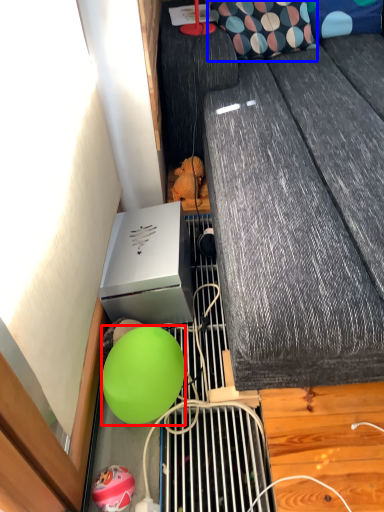
Question: Which object appears closest to the camera in this image, ball (highlighted by a red box) or pillow (highlighted by a blue box)?

Choices:
 (A) ball
 (B) pillow

Answer: (A)